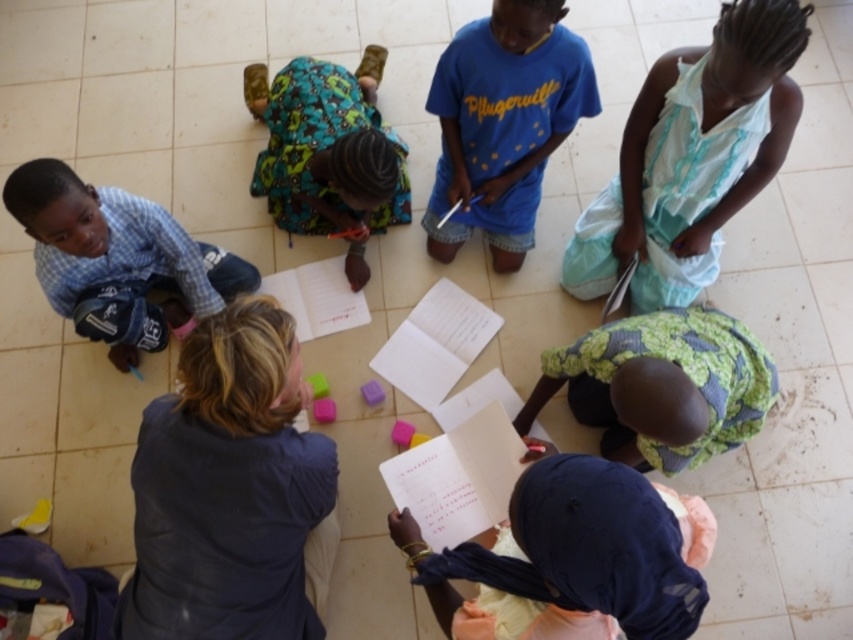
You are a photographer taking a picture of the children in the scene. You notice the white lace dress at upper right and the printed fabric dress at center. Which dress will appear closer to the camera in the photo?

The white lace dress at upper right will appear closer to the camera in the photo because it is in front of the printed fabric dress at center.

Based on the coordinates provided, which object is located at point (692, 156)?

The white lace dress at upper right is located at point (692, 156).